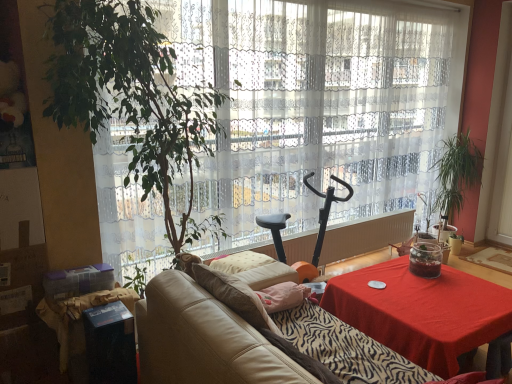
Question: Looking at their shapes, would you say green leafy plant at right is wider or thinner than leather couch at center?

Choices:
 (A) wide
 (B) thin

Answer: (B)

Question: From the image's perspective, is green leafy plant at right above or below leather couch at center?

Choices:
 (A) above
 (B) below

Answer: (A)

Question: Considering the real-world distances, which object is farthest from the black cardboard box at lower left?

Choices:
 (A) translucent glass jar at center
 (B) leather couch at center
 (C) transparent lace curtain at center
 (D) red cloth-covered table at lower right
 (E) black plastic exercise bike at center

Answer: (A)

Question: Considering the real-world distances, which object is farthest from the leather couch at center?

Choices:
 (A) green leafy plant at right
 (B) black cardboard box at lower left
 (C) red cloth-covered table at lower right
 (D) translucent glass jar at center
 (E) transparent lace curtain at center

Answer: (A)